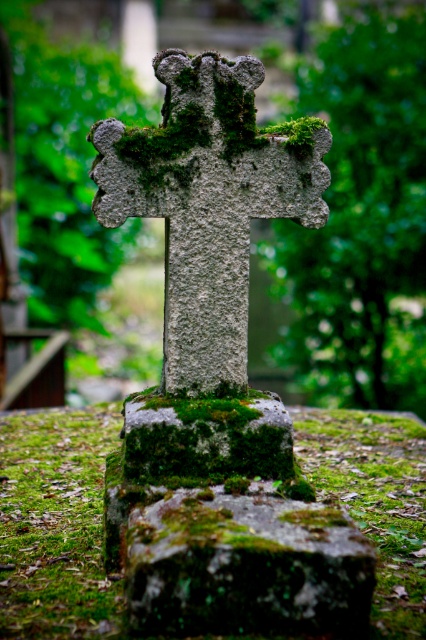
Question: Does mossy stone cross at center appear on the right side of green mossy stone at center?

Choices:
 (A) no
 (B) yes

Answer: (A)

Question: From the image, what is the correct spatial relationship of mossy stone cross at center in relation to green mossy stone at center?

Choices:
 (A) right
 (B) left

Answer: (B)

Question: Is the position of mossy stone cross at center less distant than that of green mossy stone at center?

Choices:
 (A) yes
 (B) no

Answer: (B)